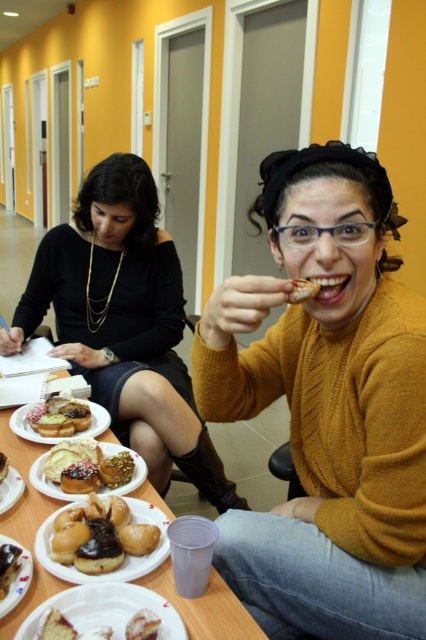
You are at a table with two desserts, a powdered sugar cake at lower center and a glazed pastry at center. Which dessert is positioned to the left of the other?

The powdered sugar cake at lower center is to the left of the glazed pastry at center.

You are a food critic who needs to take a photo of the powdered sugar cake at lower center and the glazed pastry at center. Which one should you adjust the camera angle to look up at because it is taller?

The powdered sugar cake at lower center is taller than the glazed pastry at center, so you should adjust the camera angle to look up at the powdered sugar cake at lower center.

You are standing at the point labeled point (20, 483) and want to see the person sitting at point (302, 285). Can you see them clearly without any obstruction?

Since point (20, 483) is behind point (302, 285), you cannot see the person at point (302, 285) clearly because they are in front of you.